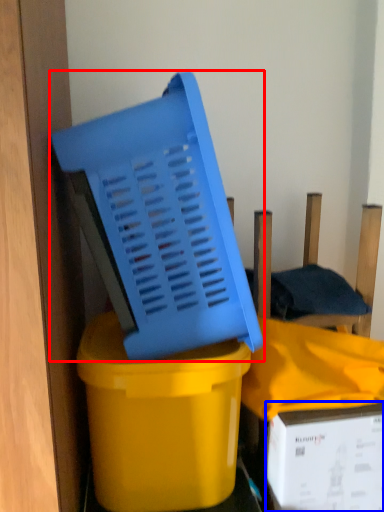
Question: Which point is closer to the camera, basket (highlighted by a red box) or box (highlighted by a blue box)?

Choices:
 (A) basket
 (B) box

Answer: (A)